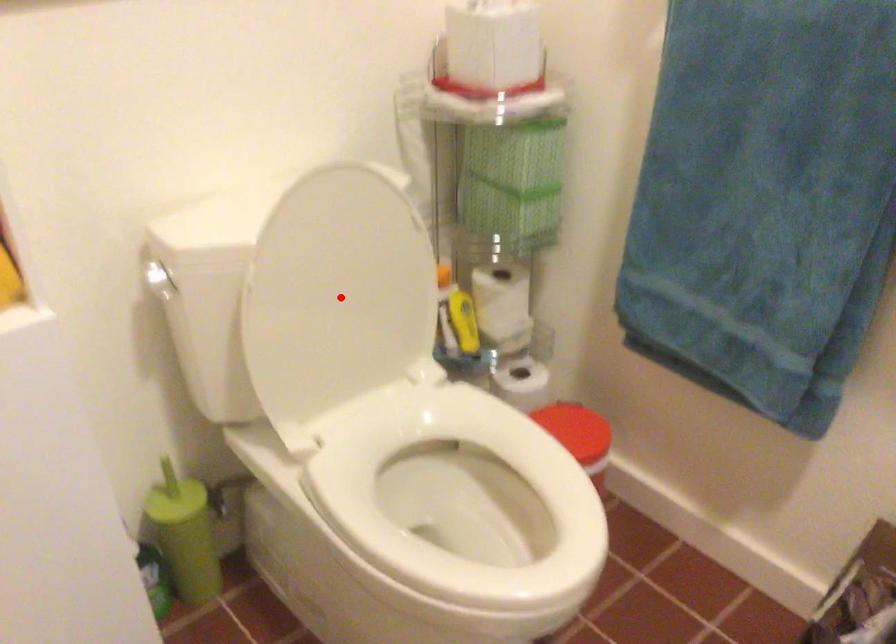
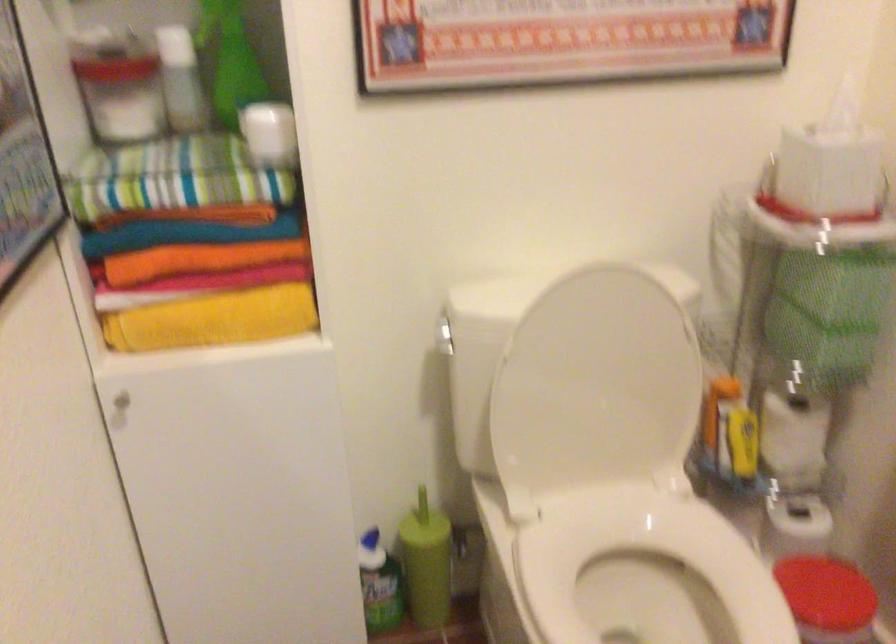
Where in the second image is the point corresponding to the highlighted location from the first image?

(595, 388)